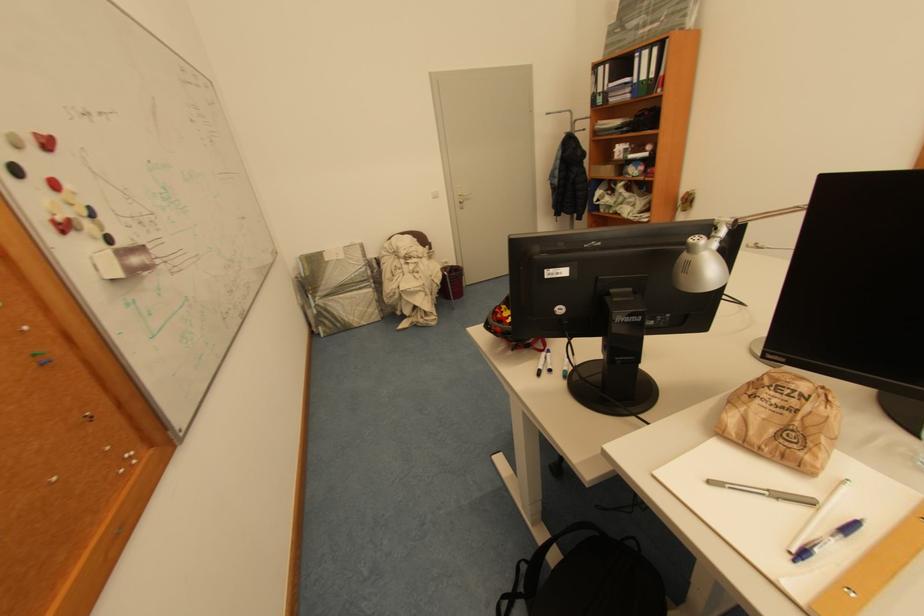
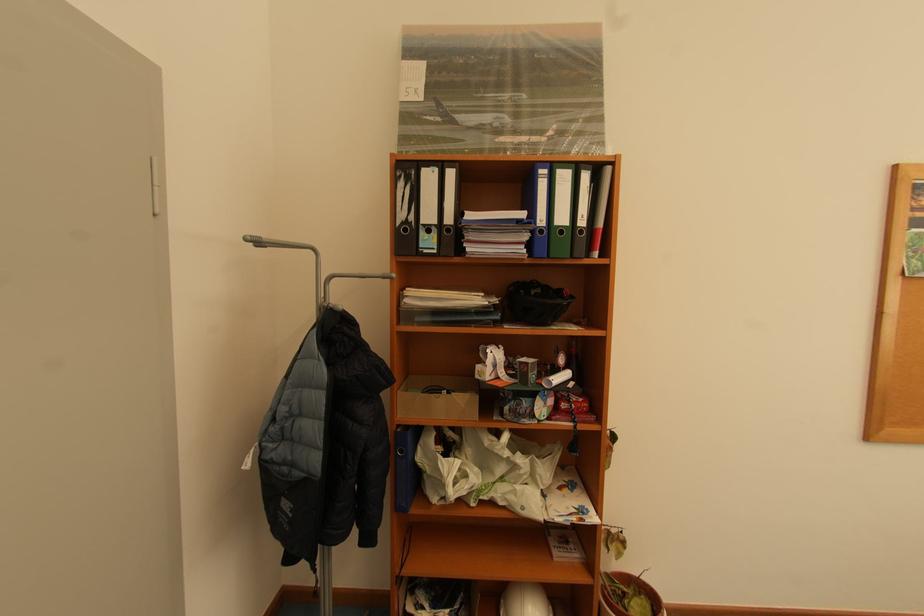
In the second image, find the point that corresponds to (606,99) in the first image.

(431, 235)